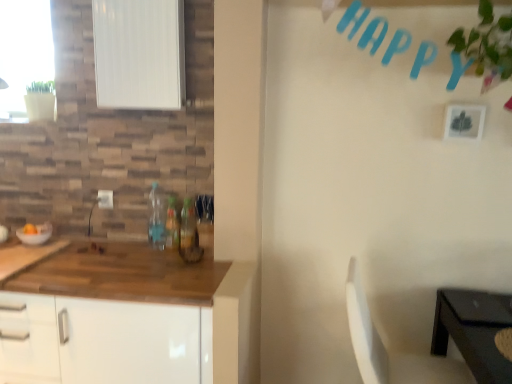
At what (x,y) coordinates should I click in order to perform the action: click on vacant space positioned to the left of translucent glass bottle at center, the third bottle positioned from the left. Please return your answer as a coordinate pair (x, y). The width and height of the screenshot is (512, 384). Looking at the image, I should click on (152, 248).